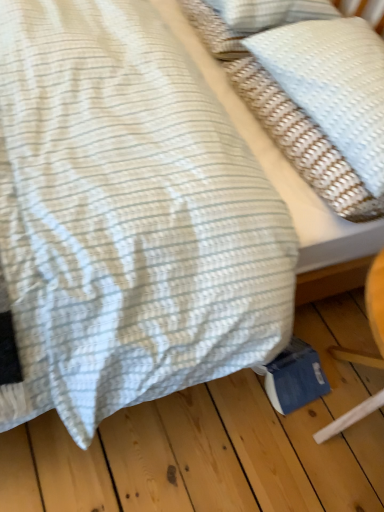
What do you see at coordinates (333, 84) in the screenshot? I see `white textured pillow at upper right` at bounding box center [333, 84].

The image size is (384, 512). Find the location of `white textured pillow at upper right`. white textured pillow at upper right is located at coordinates (333, 84).

This screenshot has width=384, height=512. What are the coordinates of `white textured pillow at upper right` in the screenshot? It's located at (333, 84).